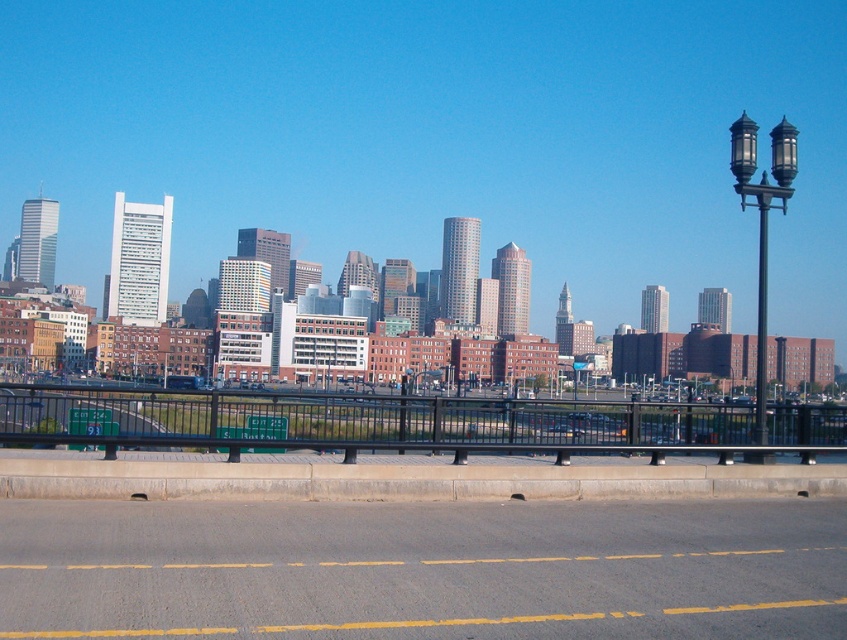
Question: Is the position of yellow asphalt road at lower center less distant than that of black metal fence at lower center?

Choices:
 (A) yes
 (B) no

Answer: (A)

Question: Based on their relative distances, which object is farther from the black metal lamp post at right?

Choices:
 (A) black metal fence at lower center
 (B) yellow asphalt road at lower center

Answer: (B)

Question: Is yellow asphalt road at lower center behind black metal fence at lower center?

Choices:
 (A) no
 (B) yes

Answer: (A)

Question: Estimate the real-world distances between objects in this image. Which object is farther from the yellow asphalt road at lower center?

Choices:
 (A) black metal lamp post at right
 (B) black metal fence at lower center

Answer: (A)

Question: Which of these objects is positioned farthest from the black metal lamp post at right?

Choices:
 (A) black metal fence at lower center
 (B) yellow asphalt road at lower center

Answer: (B)

Question: Can you confirm if yellow asphalt road at lower center is positioned above black metal lamp post at right?

Choices:
 (A) no
 (B) yes

Answer: (A)